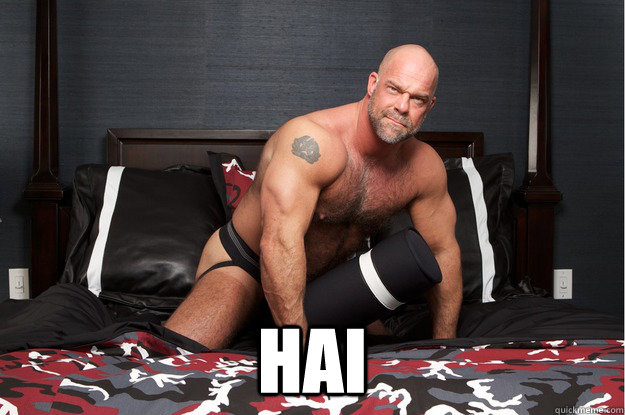
Identify the location of wall outlet. This screenshot has width=625, height=415. (561, 279).